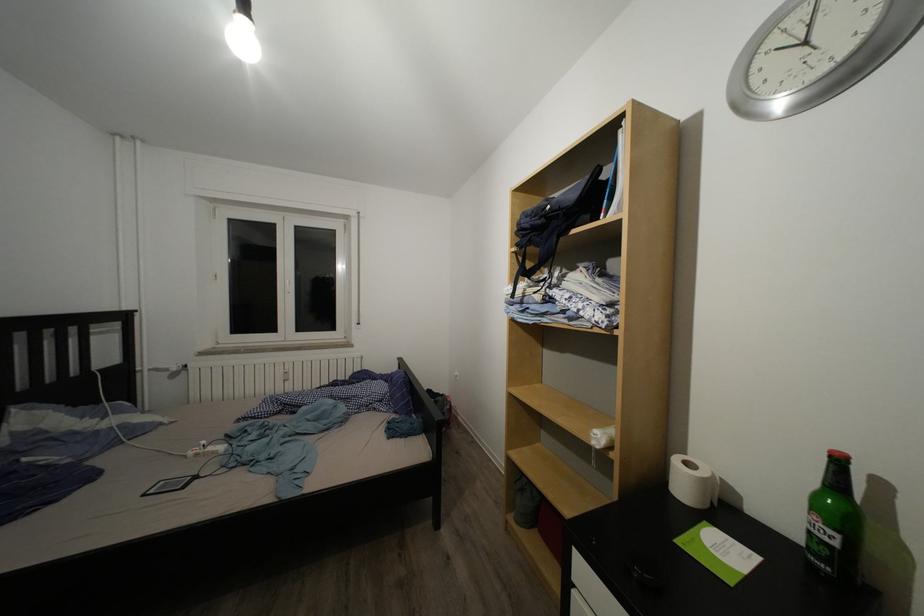
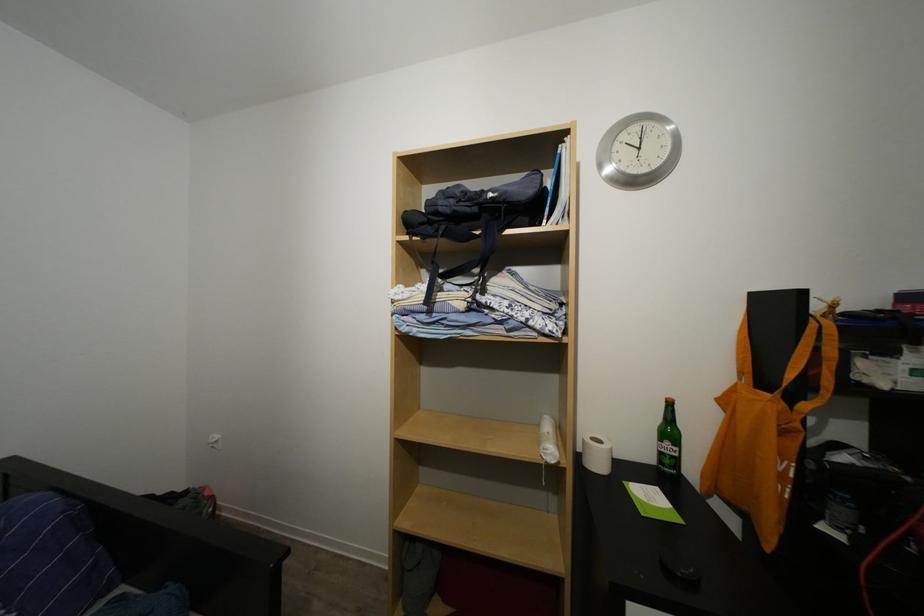
Locate, in the second image, the point that corresponds to (x=694, y=469) in the first image.

(601, 446)